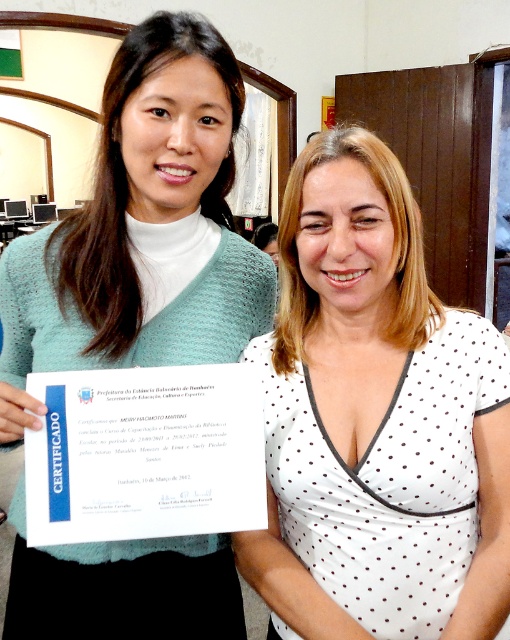
Question: Is white dotted dress at center closer to camera compared to teal knitted sweater at left?

Choices:
 (A) yes
 (B) no

Answer: (A)

Question: In this image, where is white dotted dress at center located relative to teal knitted sweater at left?

Choices:
 (A) below
 (B) above

Answer: (A)

Question: Is the position of white dotted dress at center more distant than that of teal knitted sweater at left?

Choices:
 (A) yes
 (B) no

Answer: (B)

Question: Which object is farther from the camera taking this photo?

Choices:
 (A) teal knitted sweater at left
 (B) white dotted dress at center

Answer: (A)

Question: Among these points, which one is farthest from the camera?

Choices:
 (A) (157, 237)
 (B) (381, 243)

Answer: (A)